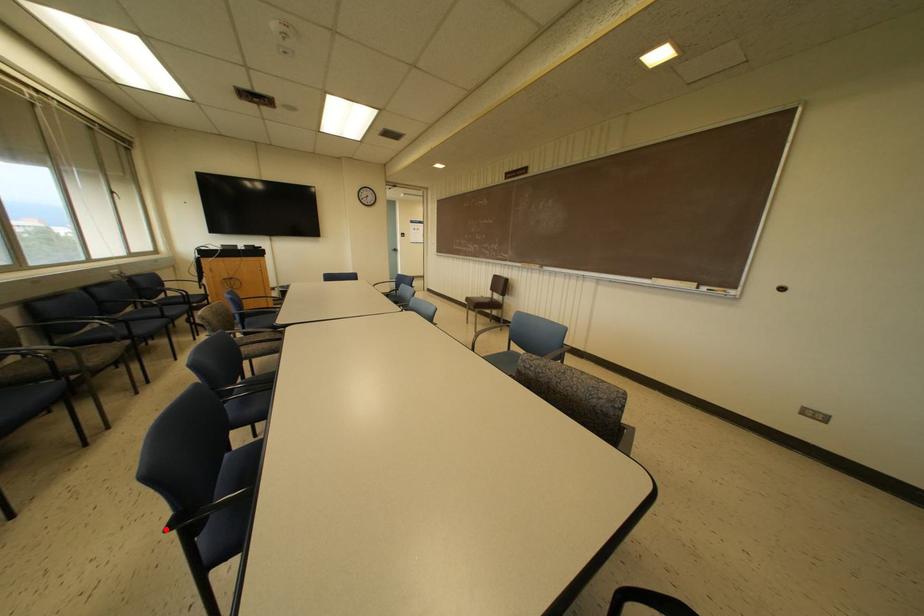
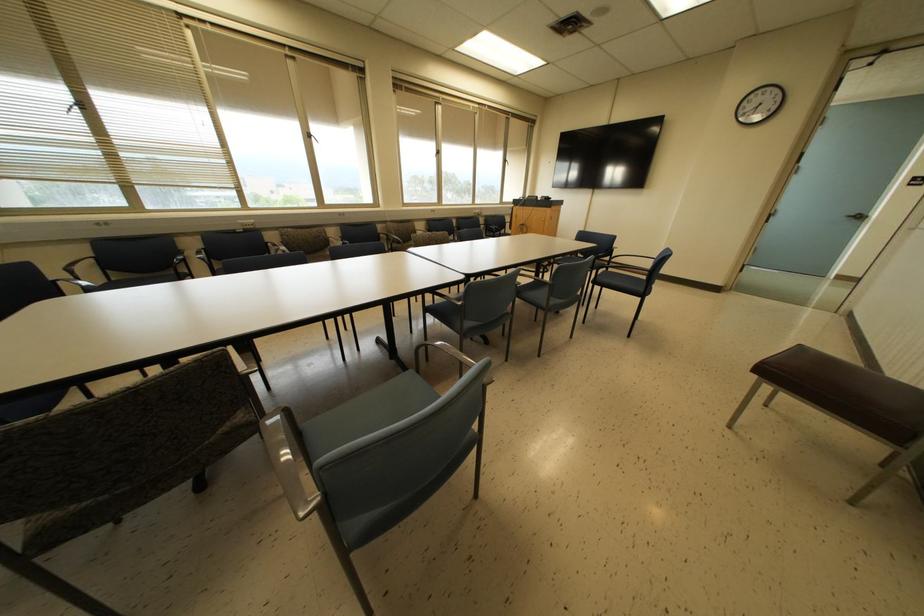
Question: I am providing you with two images of the same scene from different viewpoints. A red point is marked on the first image. At the location where the point appears in image 1, is it still visible in image 2?

Choices:
 (A) Yes
 (B) No

Answer: (B)